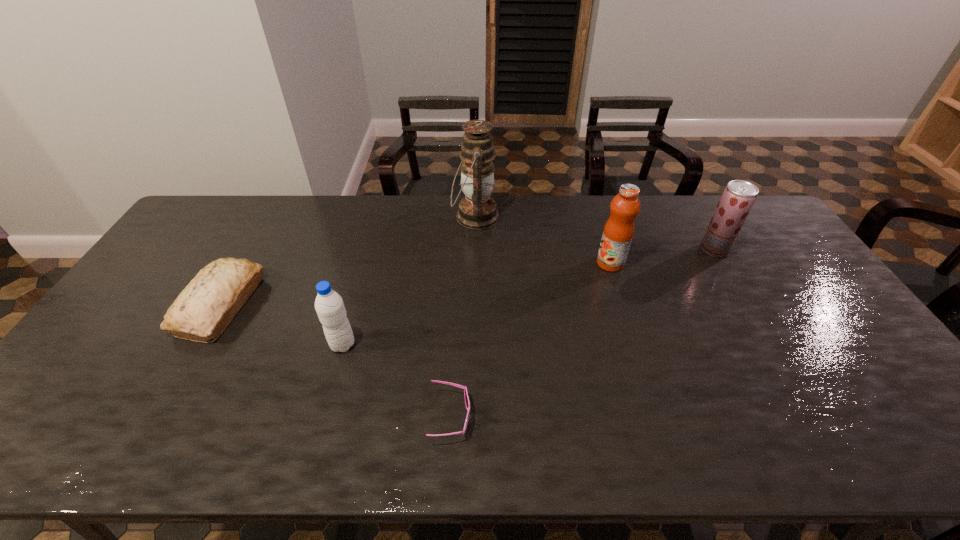
Locate an element on the screen. Image resolution: width=960 pixels, height=540 pixels. vacant point located between the fifth object from right to left and the sunglasses is located at coordinates (396, 381).

Identify the location of free space between the right fruit juice and the sunglasses. 583,333.

Where is `vacant space in between the nearest object and the right fruit juice`? vacant space in between the nearest object and the right fruit juice is located at coordinates (583, 333).

The width and height of the screenshot is (960, 540). I want to click on free space that is in between the second shortest object and the water bottle, so pos(282,325).

Identify which object is the third closest to the bread. Please provide its 2D coordinates. Your answer should be formatted as a tuple, i.e. [(x, y)], where the tuple contains the x and y coordinates of a point satisfying the conditions above.

[(477, 210)]

Select which object is the fourth closest to the tallest object. Please provide its 2D coordinates. Your answer should be formatted as a tuple, i.e. [(x, y)], where the tuple contains the x and y coordinates of a point satisfying the conditions above.

[(467, 402)]

Locate an element on the screen. This screenshot has height=540, width=960. vacant region that satisfies the following two spatial constraints: 1. on the front label of the fifth object from left to right; 2. on the front side of the fifth object from right to left is located at coordinates 636,345.

Locate an element on the screen. The height and width of the screenshot is (540, 960). vacant space that satisfies the following two spatial constraints: 1. on the back side of the bread; 2. on the left side of the tallest object is located at coordinates (271, 217).